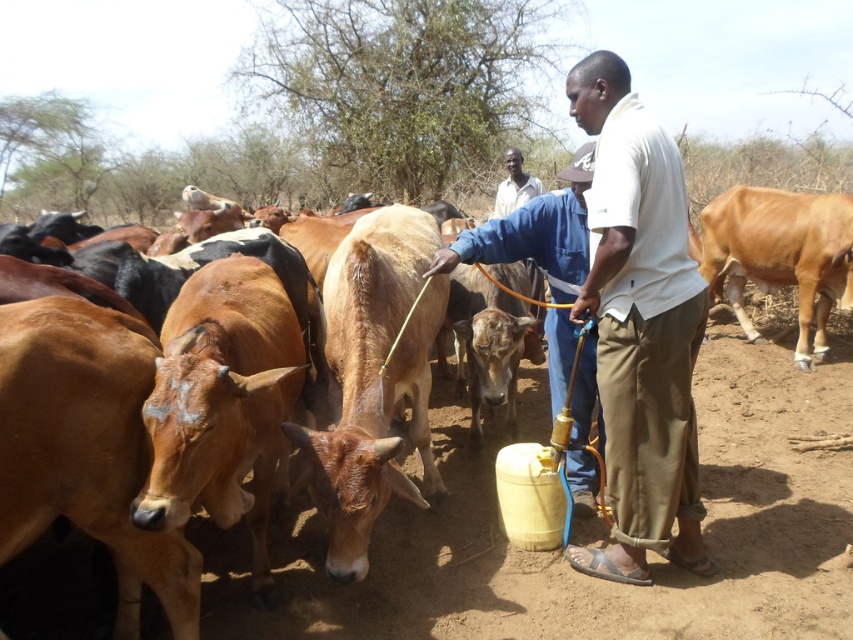
Between white cotton shirt at center and light brown smooth cow at right, which one appears on the right side from the viewer's perspective?

light brown smooth cow at right is more to the right.

Is white cotton shirt at center below light brown smooth cow at right?

Indeed, white cotton shirt at center is positioned under light brown smooth cow at right.

Locate an element on the screen. The height and width of the screenshot is (640, 853). white cotton shirt at center is located at coordinates (640, 326).

Is point (689, 307) farther from camera compared to point (524, 186)?

No, (689, 307) is closer to viewer.

Does white cotton shirt at center have a smaller size compared to light brown shirt at center?

Incorrect, white cotton shirt at center is not smaller in size than light brown shirt at center.

Is point (675, 266) farther from viewer compared to point (497, 196)?

No, it is in front of (497, 196).

The image size is (853, 640). Identify the location of white cotton shirt at center. (640, 326).

Is blue denim shirt at center thinner than light brown shirt at center?

No.

Does blue denim shirt at center lie behind light brown shirt at center?

No, it is in front of light brown shirt at center.

Is point (572, 493) less distant than point (520, 192)?

Yes, point (572, 493) is closer to viewer.

This screenshot has width=853, height=640. I want to click on blue denim shirt at center, so click(537, 234).